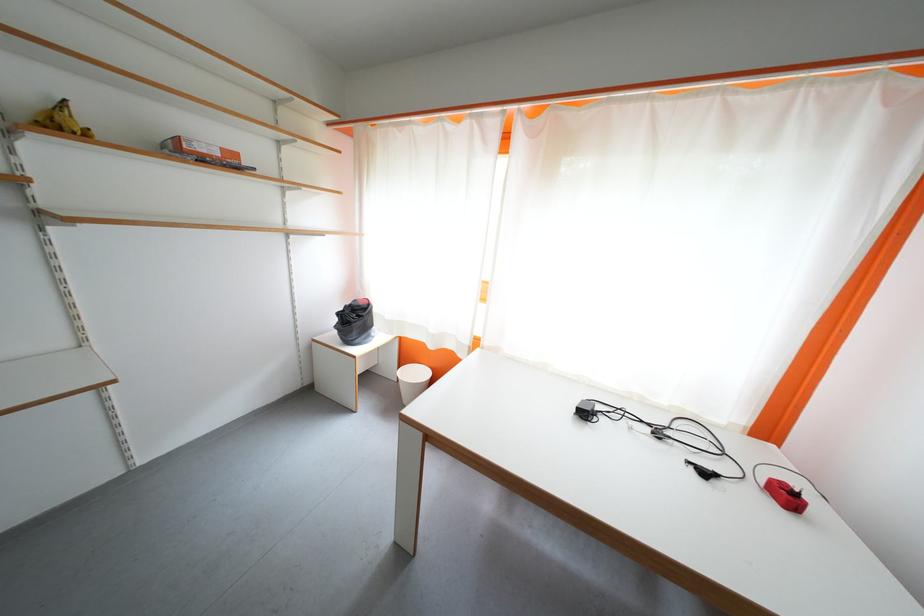
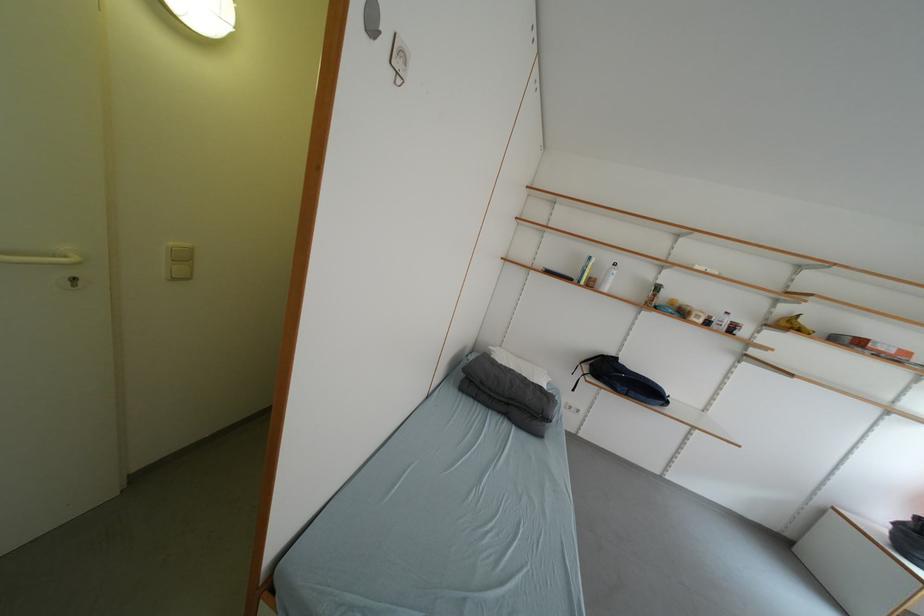
The point at (x=68, y=129) is marked in the first image. Where is the corresponding point in the second image?

(797, 328)